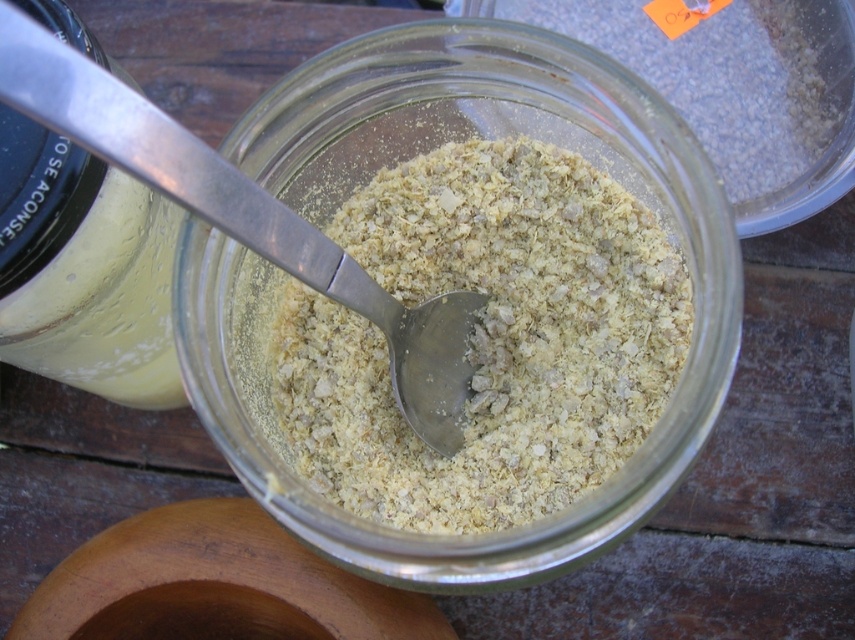
You are a baker preparing a recipe that requires mixing the white crumbly substance at center with an ingredient from the container with a dark lid. You need to remove the silver metallic spoon at center first. Is the spoon above or below the substance?

The white crumbly substance at center is positioned under the silver metallic spoon at center, so the spoon is above the substance.

You are a baker preparing to mix ingredients. You have a white crumbly substance at center and a silver metallic spoon at center. Which object is located to the right of the other?

The white crumbly substance at center is positioned on the right side of silver metallic spoon at center, so the white crumbly substance is to the right of the silver metallic spoon.